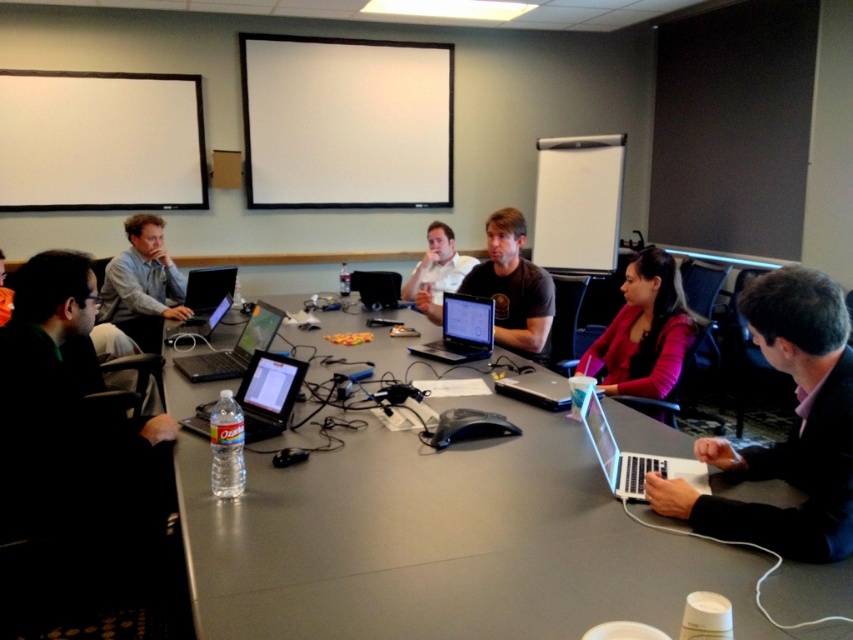
You are a participant in the meeting and need to access your laptop. You are currently looking at the silver metallic laptop at lower right and the white matte shirt at center. Which object is closer to you?

The silver metallic laptop at lower right is closer to you because it is positioned under the white matte shirt at center, meaning it is in front of it and thus nearer to your viewpoint.